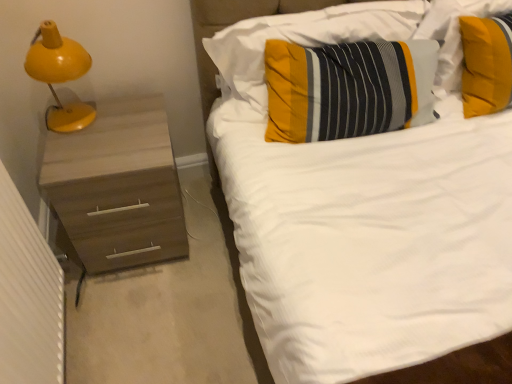
Find the location of `free space in front of yellow matte lamp at left`. free space in front of yellow matte lamp at left is located at coordinates (x=76, y=149).